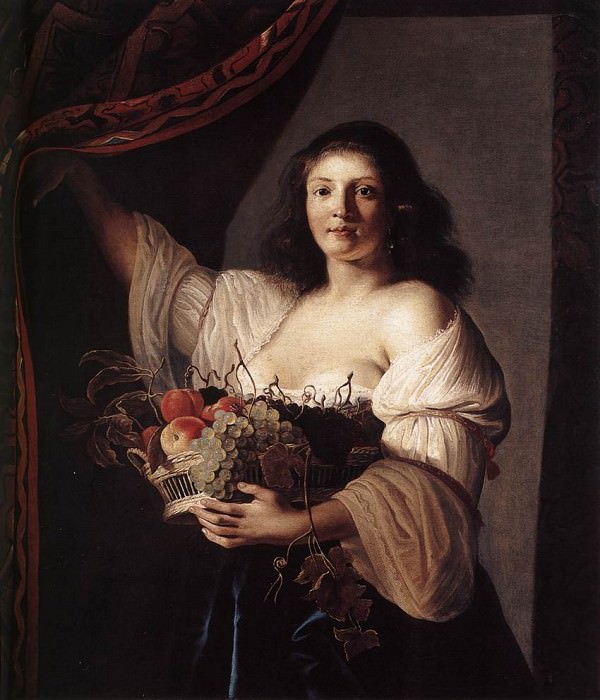
The image size is (600, 700). In order to click on basket in this screenshot , I will do tap(175, 470).